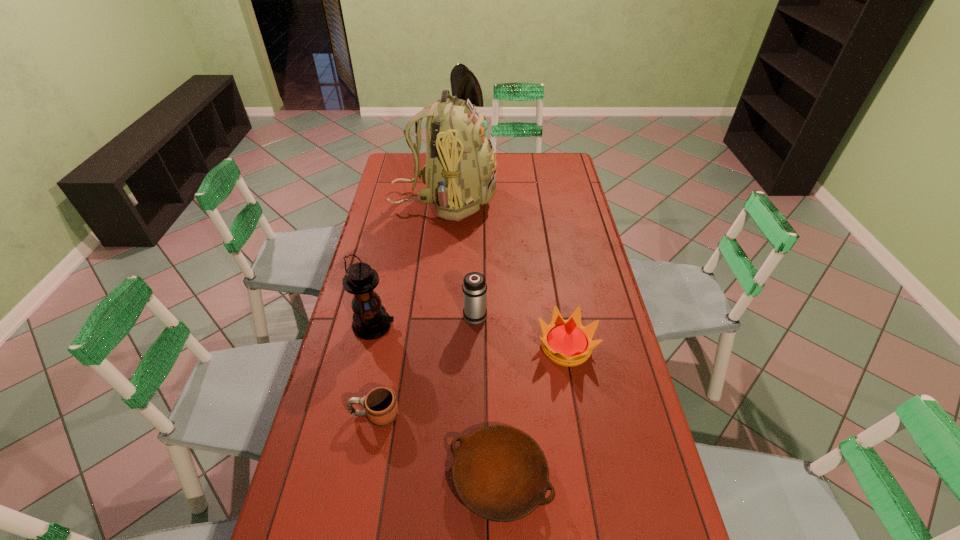
In order to click on lantern positioned at the left edge in this screenshot , I will do `click(371, 321)`.

The image size is (960, 540). Identify the location of mug situated at the left edge. (381, 407).

I want to click on object positioned at the right edge, so click(x=567, y=343).

What are the coordinates of `object present at the far left corner` in the screenshot? It's located at (460, 173).

In the image, there is a desktop. Identify the location of vacant area at the far edge. Image resolution: width=960 pixels, height=540 pixels. (509, 157).

The width and height of the screenshot is (960, 540). Identify the location of blank area at the left edge. (356, 383).

This screenshot has height=540, width=960. In the image, there is a desktop. What are the coordinates of `vacant region at the right edge` in the screenshot? It's located at (584, 213).

The width and height of the screenshot is (960, 540). I want to click on vacant area that lies between the lantern and the nearest object, so 437,401.

Identify the location of unoccupied area between the third tallest object and the farthest object. (460, 258).

Image resolution: width=960 pixels, height=540 pixels. What are the coordinates of `free space between the fourth shortest object and the fifth farthest object` in the screenshot? It's located at (425, 365).